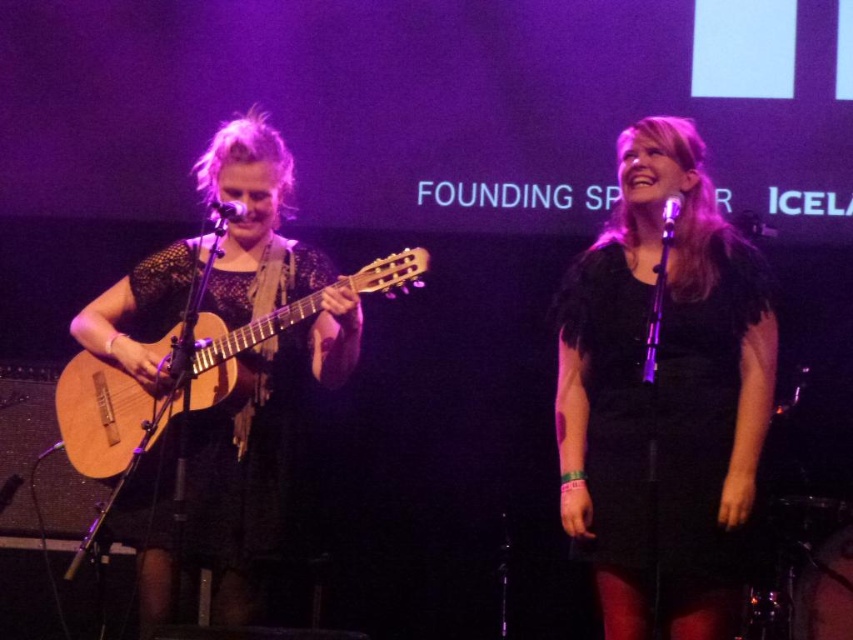
You are a photographer at the back of the venue. You want to capture a photo that includes both the black feathered dress at center and the natural wood acoustic guitar at left. Given that your camera can only focus on objects within a 1.2 meter width, will both objects fit in the frame?

The black feathered dress at center is larger in size than the natural wood acoustic guitar at left. Since the camera can only focus on objects within a 1.2 meter width, and the dress is larger, it may exceed the frame. However, the exact positioning and distance from the camera would determine if both fit. Without specific spatial details like distance or exact dimensions beyond size comparison, it is uncertain if both will fit within the 1.2 meter width.

You are a stagehand who needs to place a 1.2 meter wide equipment between the black feathered dress at center and the natural wood acoustic guitar at left. Is there enough space?

The distance between the black feathered dress at center and the natural wood acoustic guitar at left is 1.02 meters. Since the equipment is 1.2 meters wide, it won

You are a photographer positioned at the front of the stage. You want to capture a photo that includes both the person playing the acoustic guitar on the left and the individual in the black feathered dress at center. Based on their positions, which direction should you adjust your camera to ensure both subjects are in frame?

The black feathered dress at center is located at point (664, 394), so you should adjust your camera to the right to include both the acoustic guitar player on the left and the individual in the black feathered dress at center in the frame.